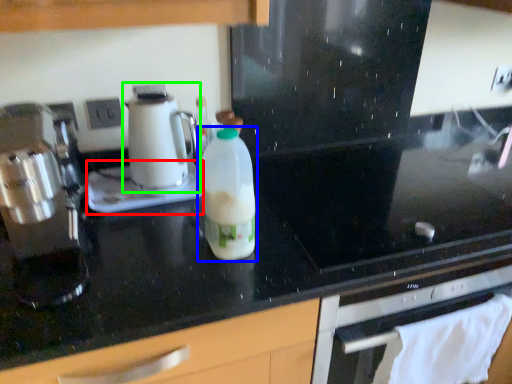
Question: Estimate the real-world distances between objects in this image. Which object is farther from appliance (highlighted by a red box), bottle (highlighted by a blue box) or kitchen appliance (highlighted by a green box)?

Choices:
 (A) bottle
 (B) kitchen appliance

Answer: (A)